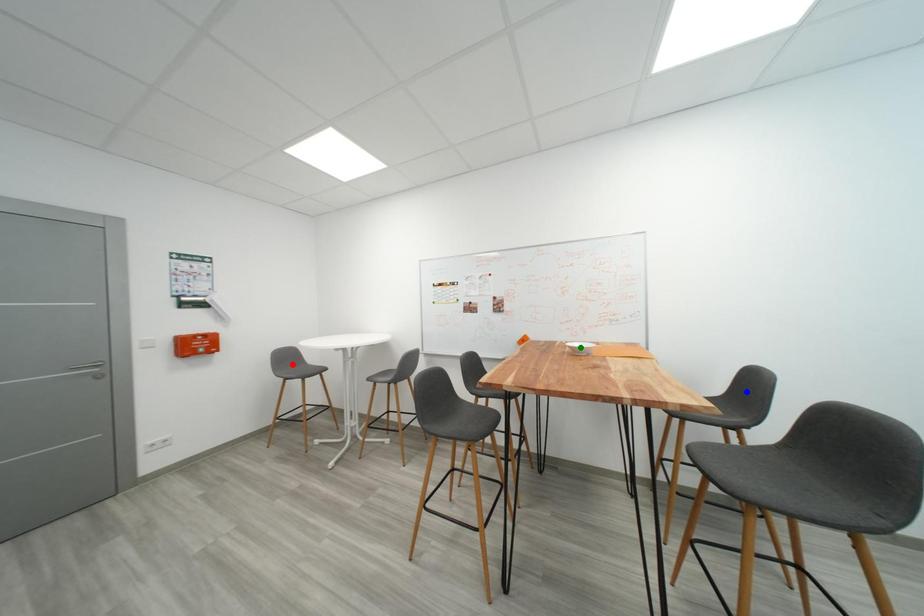
Order these from farthest to nearest:
A) green point
B) blue point
C) red point

red point, green point, blue point